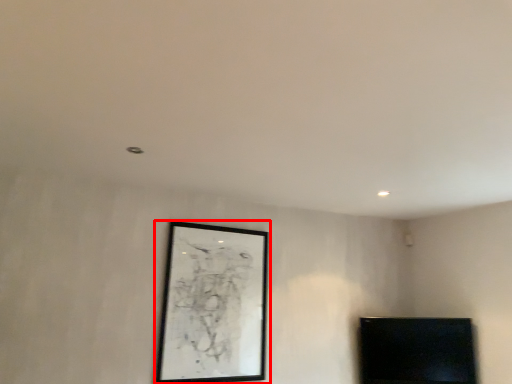
Question: From the image, what is the correct spatial relationship of picture frame (annotated by the red box) in relation to furniture?

Choices:
 (A) left
 (B) right

Answer: (A)